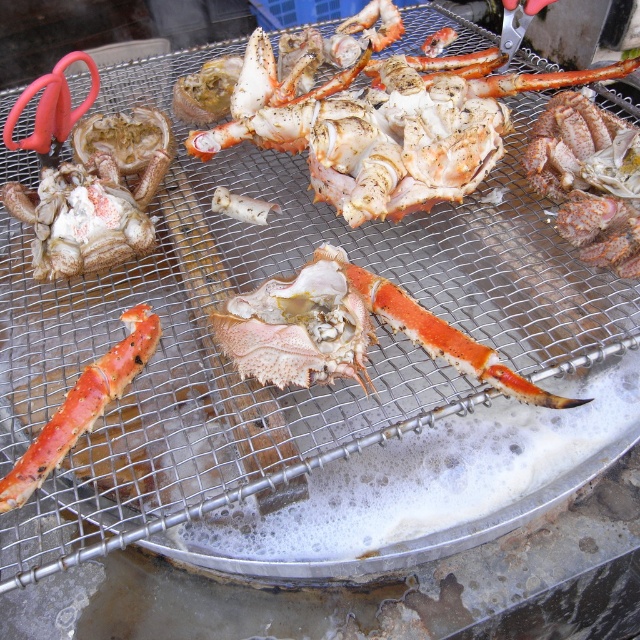
Question: Which object appears closest to the camera in this image?

Choices:
 (A) speckled white lobster at center
 (B) smooth orange crab leg at center

Answer: (B)

Question: Does speckled white lobster at center have a larger size compared to pinkish-orange shell at center?

Choices:
 (A) yes
 (B) no

Answer: (A)

Question: Based on their relative distances, which object is nearer to the smooth orange crab leg at center?

Choices:
 (A) pinkish-orange shell at center
 (B) speckled white lobster at center

Answer: (A)

Question: Can you confirm if speckled white lobster at center is positioned above pinkish-orange shell at center?

Choices:
 (A) no
 (B) yes

Answer: (B)

Question: Which point is farther from the camera taking this photo?

Choices:
 (A) (296, 292)
 (B) (77, 378)
 (C) (337, 129)

Answer: (C)

Question: Is pinkish-orange shell at center wider than smooth orange crab leg at center?

Choices:
 (A) yes
 (B) no

Answer: (A)